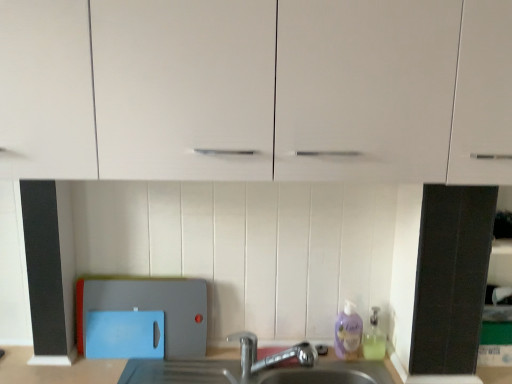
Question: From a real-world perspective, is white glossy cabinet at upper center under silver metallic faucet at lower center?

Choices:
 (A) yes
 (B) no

Answer: (B)

Question: Can you confirm if white glossy cabinet at upper center is wider than silver metallic faucet at lower center?

Choices:
 (A) no
 (B) yes

Answer: (B)

Question: Is white glossy cabinet at upper center turned away from silver metallic faucet at lower center?

Choices:
 (A) yes
 (B) no

Answer: (B)

Question: From the image's perspective, is white glossy cabinet at upper center over silver metallic faucet at lower center?

Choices:
 (A) yes
 (B) no

Answer: (A)

Question: Considering the relative sizes of white glossy cabinet at upper center and silver metallic faucet at lower center in the image provided, is white glossy cabinet at upper center thinner than silver metallic faucet at lower center?

Choices:
 (A) no
 (B) yes

Answer: (A)

Question: Choose the correct answer: Is silver metallic faucet at lower center inside blue plastic cutting board at lower left or outside it?

Choices:
 (A) outside
 (B) inside

Answer: (A)

Question: From a real-world perspective, is silver metallic faucet at lower center physically located above or below blue plastic cutting board at lower left?

Choices:
 (A) below
 (B) above

Answer: (A)

Question: In the image, is silver metallic faucet at lower center positioned in front of or behind blue plastic cutting board at lower left?

Choices:
 (A) front
 (B) behind

Answer: (A)

Question: Is silver metallic faucet at lower center to the left or to the right of blue plastic cutting board at lower left in the image?

Choices:
 (A) right
 (B) left

Answer: (A)

Question: Is blue plastic cutting board at lower left wider or thinner than white glossy cabinet at upper center?

Choices:
 (A) wide
 (B) thin

Answer: (B)

Question: Do you think blue plastic cutting board at lower left is within white glossy cabinet at upper center, or outside of it?

Choices:
 (A) outside
 (B) inside

Answer: (A)

Question: Considering the positions of blue plastic cutting board at lower left and white glossy cabinet at upper center in the image, is blue plastic cutting board at lower left bigger or smaller than white glossy cabinet at upper center?

Choices:
 (A) big
 (B) small

Answer: (B)

Question: Is point (168, 278) closer or farther from the camera than point (178, 170)?

Choices:
 (A) farther
 (B) closer

Answer: (A)

Question: Considering the positions of purple translucent liquid soap at lower right, which is counted as the 1th cleaning product, starting from the left, and blue plastic cutting board at lower left in the image, is purple translucent liquid soap at lower right, which is counted as the 1th cleaning product, starting from the left, taller or shorter than blue plastic cutting board at lower left?

Choices:
 (A) tall
 (B) short

Answer: (B)

Question: From a real-world perspective, is purple translucent liquid soap at lower right, which is counted as the 1th cleaning product, starting from the left, above or below blue plastic cutting board at lower left?

Choices:
 (A) below
 (B) above

Answer: (A)